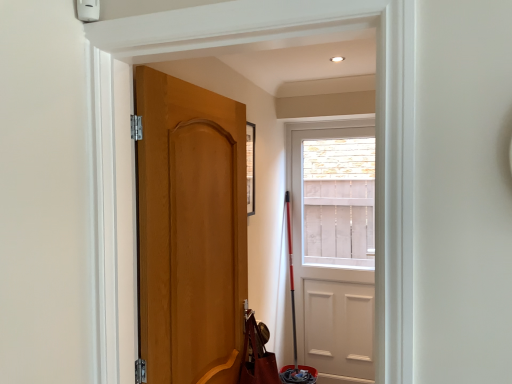
I want to click on matte wood door at center, which ranks as the second door in back-to-front order, so click(x=189, y=225).

Which is further, (188, 277) or (272, 364)?

The point (272, 364) is farther from the camera.

From a real-world perspective, does matte wood door at center, which is the first door in left-to-right order, sit lower than brown leather shoulder bag at lower left?

No, from a real-world perspective, matte wood door at center, which is the first door in left-to-right order, is not under brown leather shoulder bag at lower left.

Considering the relative positions of matte wood door at center, positioned as the first door in front-to-back order, and brown leather shoulder bag at lower left in the image provided, is matte wood door at center, positioned as the first door in front-to-back order, to the left of brown leather shoulder bag at lower left from the viewer's perspective?

Yes.

Is matte wood door at center, which is the first door in left-to-right order, positioned far away from brown leather shoulder bag at lower left?

matte wood door at center, which is the first door in left-to-right order, is near brown leather shoulder bag at lower left, not far away.

Which of these two, matte wood door at center, which is the first door in left-to-right order, or white matte door at center, the 1th door when ordered from right to left, is wider?

Wider between the two is white matte door at center, the 1th door when ordered from right to left.

Considering the positions of objects matte wood door at center, which ranks as the second door in back-to-front order, and white matte door at center, placed as the 2th door when sorted from front to back, in the image provided, who is behind, matte wood door at center, which ranks as the second door in back-to-front order, or white matte door at center, placed as the 2th door when sorted from front to back,?

white matte door at center, placed as the 2th door when sorted from front to back, is further from the camera.

Considering the relative positions of matte wood door at center, which is the second door from right to left, and white matte door at center, which is counted as the 2th door, starting from the left, in the image provided, is matte wood door at center, which is the second door from right to left, to the left of white matte door at center, which is counted as the 2th door, starting from the left, from the viewer's perspective?

Indeed, matte wood door at center, which is the second door from right to left, is positioned on the left side of white matte door at center, which is counted as the 2th door, starting from the left.

From the image's perspective, does matte wood door at center, which is the first door in left-to-right order, appear lower than white matte door at center, which appears as the 1th door when viewed from the back?

Actually, matte wood door at center, which is the first door in left-to-right order, appears above white matte door at center, which appears as the 1th door when viewed from the back, in the image.

Between white matte door at center, which appears as the 1th door when viewed from the back, and brown leather shoulder bag at lower left, which one appears on the left side from the viewer's perspective?

brown leather shoulder bag at lower left is more to the left.

Identify the location of shoulder bag located on the left of white matte door at center, placed as the 2th door when sorted from front to back. This screenshot has height=384, width=512. pos(257,356).

Is white matte door at center, placed as the 2th door when sorted from front to back, far from brown leather shoulder bag at lower left?

Indeed, white matte door at center, placed as the 2th door when sorted from front to back, is not near brown leather shoulder bag at lower left.

Is white matte door at center, placed as the 2th door when sorted from front to back, shorter than brown leather shoulder bag at lower left?

Incorrect, the height of white matte door at center, placed as the 2th door when sorted from front to back, does not fall short of that of brown leather shoulder bag at lower left.

From the image's perspective, is brown leather shoulder bag at lower left below white matte door at center, which is counted as the 2th door, starting from the left?

Yes, from the image's perspective, brown leather shoulder bag at lower left is beneath white matte door at center, which is counted as the 2th door, starting from the left.

Considering the points (263, 353) and (362, 354), which point is in front, point (263, 353) or point (362, 354)?

The point (263, 353) is closer.

From a real-world perspective, relative to white matte door at center, placed as the 2th door when sorted from front to back, is brown leather shoulder bag at lower left vertically above or below?

Clearly, from a real-world perspective, brown leather shoulder bag at lower left is below white matte door at center, placed as the 2th door when sorted from front to back.

Based on their positions, is brown leather shoulder bag at lower left located to the left or right of white matte door at center, the 1th door when ordered from right to left?

From the image, it's evident that brown leather shoulder bag at lower left is to the left of white matte door at center, the 1th door when ordered from right to left.

From a real-world perspective, which is physically below, brown leather shoulder bag at lower left or matte wood door at center, positioned as the first door in front-to-back order?

brown leather shoulder bag at lower left.

Is brown leather shoulder bag at lower left in contact with matte wood door at center, which is the second door from right to left?

brown leather shoulder bag at lower left and matte wood door at center, which is the second door from right to left, are clearly separated.

Considering the positions of objects brown leather shoulder bag at lower left and matte wood door at center, positioned as the first door in front-to-back order, in the image provided, who is behind, brown leather shoulder bag at lower left or matte wood door at center, positioned as the first door in front-to-back order,?

brown leather shoulder bag at lower left.

From the image's perspective, which object appears higher, brown leather shoulder bag at lower left or matte wood door at center, which is the second door from right to left?

From the image's view, matte wood door at center, which is the second door from right to left, is above.

Looking at the image, does white matte door at center, the 1th door when ordered from right to left, seem bigger or smaller compared to matte wood door at center, which is the second door from right to left?

In the image, white matte door at center, the 1th door when ordered from right to left, appears to be larger than matte wood door at center, which is the second door from right to left.

Image resolution: width=512 pixels, height=384 pixels. What are the coordinates of `door positioned vertically above the white matte door at center, which appears as the 1th door when viewed from the back (from a real-world perspective)` in the screenshot? It's located at (189, 225).

Is white matte door at center, placed as the 2th door when sorted from front to back, positioned far away from matte wood door at center, which is the first door in left-to-right order?

Yes, white matte door at center, placed as the 2th door when sorted from front to back, is far from matte wood door at center, which is the first door in left-to-right order.

How much distance is there between white matte door at center, which appears as the 1th door when viewed from the back, and matte wood door at center, positioned as the first door in front-to-back order?

white matte door at center, which appears as the 1th door when viewed from the back, and matte wood door at center, positioned as the first door in front-to-back order, are 8.81 feet apart.

This screenshot has width=512, height=384. Find the location of `shoulder bag behind the matte wood door at center, which ranks as the second door in back-to-front order`. shoulder bag behind the matte wood door at center, which ranks as the second door in back-to-front order is located at coordinates (257, 356).

In the image, there is a matte wood door at center, which ranks as the second door in back-to-front order. Identify the location of door below it (from the image's perspective). Image resolution: width=512 pixels, height=384 pixels. (334, 249).

Looking at the image, which one is located further to brown leather shoulder bag at lower left, white matte door at center, which appears as the 1th door when viewed from the back, or matte wood door at center, which ranks as the second door in back-to-front order?

white matte door at center, which appears as the 1th door when viewed from the back.

Estimate the real-world distances between objects in this image. Which object is further from matte wood door at center, which ranks as the second door in back-to-front order, brown leather shoulder bag at lower left or white matte door at center, which is counted as the 2th door, starting from the left?

The object further to matte wood door at center, which ranks as the second door in back-to-front order, is white matte door at center, which is counted as the 2th door, starting from the left.

Considering their positions, is brown leather shoulder bag at lower left positioned closer to white matte door at center, which appears as the 1th door when viewed from the back, than matte wood door at center, which ranks as the second door in back-to-front order?

Based on the image, brown leather shoulder bag at lower left appears to be nearer to white matte door at center, which appears as the 1th door when viewed from the back.

Which object lies nearer to the anchor point white matte door at center, which appears as the 1th door when viewed from the back, matte wood door at center, which is the first door in left-to-right order, or brown leather shoulder bag at lower left?

brown leather shoulder bag at lower left.

Looking at the image, which one is located further to brown leather shoulder bag at lower left, matte wood door at center, positioned as the first door in front-to-back order, or white matte door at center, which appears as the 1th door when viewed from the back?

white matte door at center, which appears as the 1th door when viewed from the back, is further to brown leather shoulder bag at lower left.

In the scene shown: Based on their spatial positions, is white matte door at center, which appears as the 1th door when viewed from the back, or brown leather shoulder bag at lower left further from matte wood door at center, which ranks as the second door in back-to-front order?

white matte door at center, which appears as the 1th door when viewed from the back, is positioned further to the anchor matte wood door at center, which ranks as the second door in back-to-front order.

Find the location of a particular element. shoulder bag between matte wood door at center, which ranks as the second door in back-to-front order, and white matte door at center, which appears as the 1th door when viewed from the back, in the front-back direction is located at coordinates (257, 356).